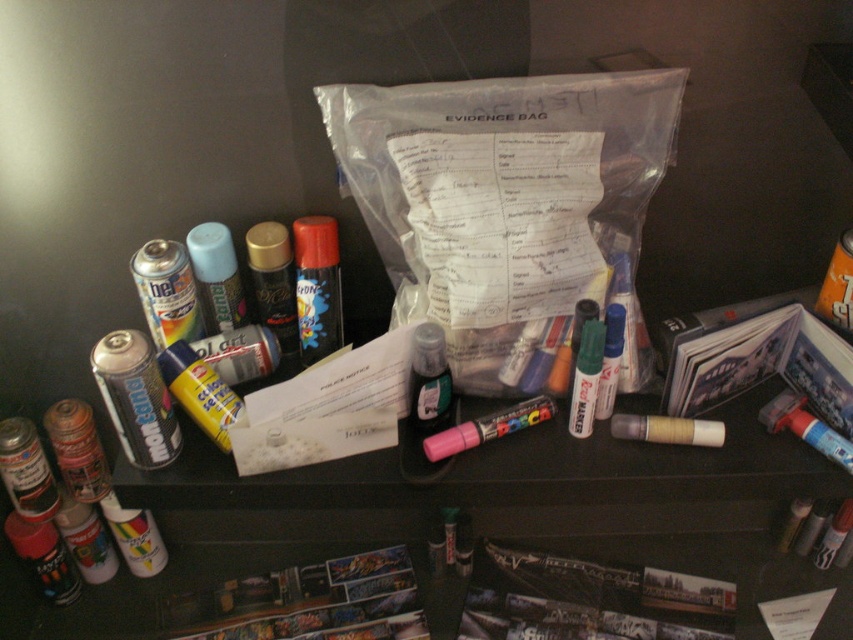
You are an artist who needs to store your pink matte marker at center securely. You have a transparent plastic evidence bag at center that is taller than the marker. Can the marker fit vertically inside the evidence bag?

The transparent plastic evidence bag at center is taller than the pink matte marker at center, so yes, the marker can fit vertically inside the evidence bag.

You are an art collector examining the items on the desk. You notice the transparent plastic evidence bag at center and the pink matte marker at center. Which item is physically covering the other?

The transparent plastic evidence bag at center is positioned over the pink matte marker at center, so it is covering the marker.